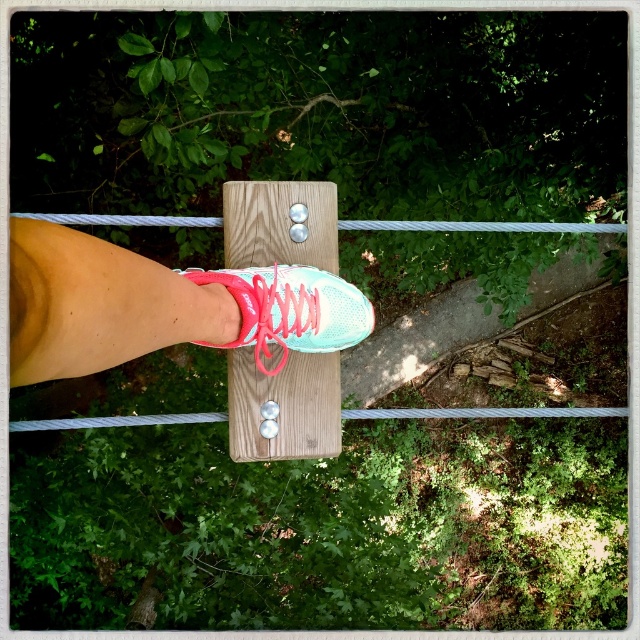
Question: Which point is farther to the camera?

Choices:
 (A) teal matte shoe at center
 (B) shiny teal sneaker at center

Answer: (A)

Question: Can you confirm if shiny teal sneaker at center is positioned above teal matte shoe at center?

Choices:
 (A) yes
 (B) no

Answer: (A)

Question: Which point is farther from the camera taking this photo?

Choices:
 (A) (172, 301)
 (B) (326, 349)

Answer: (B)

Question: Can you confirm if shiny teal sneaker at center is positioned to the right of teal matte shoe at center?

Choices:
 (A) no
 (B) yes

Answer: (A)

Question: Can you confirm if shiny teal sneaker at center is positioned to the left of teal matte shoe at center?

Choices:
 (A) yes
 (B) no

Answer: (A)